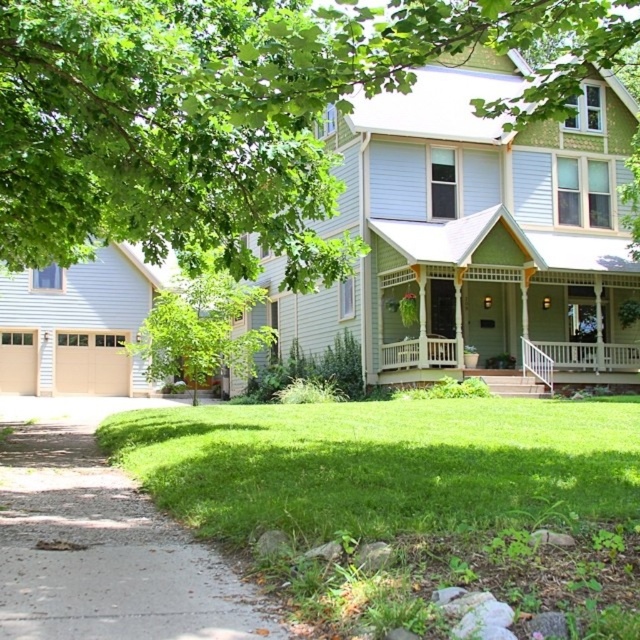
You are standing on the porch of the house and want to walk to the green leafy tree at center. Which direction should you head relative to the green grass at lower center?

The green grass at lower center is located below the green leafy tree at center, so to reach the tree, you should head upwards from the green grass at lower center.

You are standing in front of the house and want to walk to the white wooden porch at center. Which direction should you move relative to the green grass at lower center?

Since the green grass at lower center is closer to the viewer than the white wooden porch at center, you should move away from the green grass at lower center to reach the white wooden porch at center.